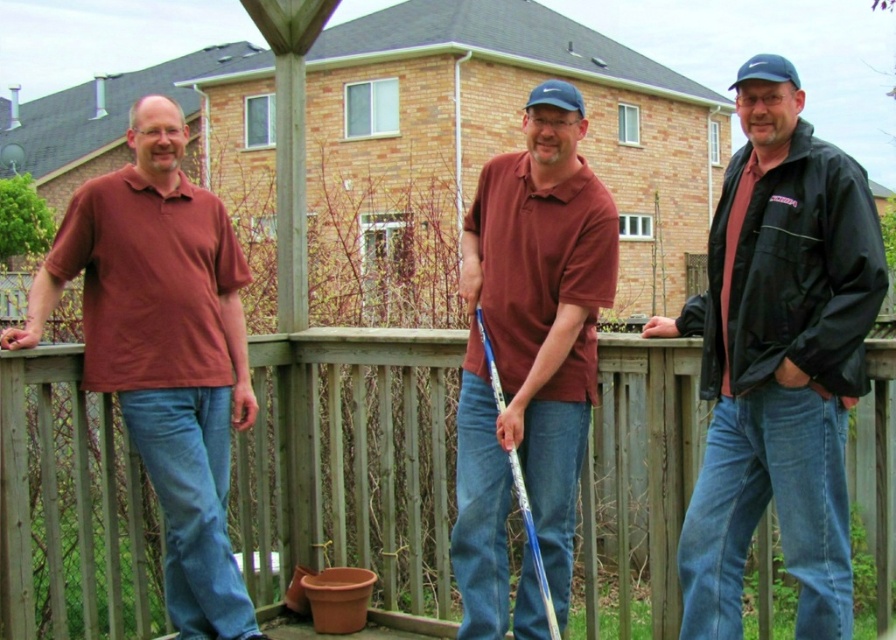
Is point (56, 244) behind point (527, 422)?

Yes, it is.

Does matte red shirt at left have a lesser height compared to matte maroon polo shirt at center?

In fact, matte red shirt at left may be taller than matte maroon polo shirt at center.

Between point (166, 372) and point (478, 461), which one is positioned behind?

The point (166, 372) is behind.

Find the location of a particular element. This screenshot has height=640, width=896. matte red shirt at left is located at coordinates (164, 349).

Is black matte jacket at center smaller than matte red shirt at left?

Correct, black matte jacket at center occupies less space than matte red shirt at left.

Between black matte jacket at center and matte red shirt at left, which one appears on the right side from the viewer's perspective?

Positioned to the right is black matte jacket at center.

Based on the photo, measure the distance between point [721,208] and camera.

Point [721,208] and camera are 12.98 feet apart from each other.

Where is `black matte jacket at center`? black matte jacket at center is located at coordinates click(778, 360).

Based on the photo, who is taller, wooden railing at center or black matte jacket at center?

black matte jacket at center is taller.

Is wooden railing at center positioned before black matte jacket at center?

No, wooden railing at center is further to the viewer.

What do you see at coordinates (349, 460) in the screenshot? I see `wooden railing at center` at bounding box center [349, 460].

I want to click on wooden railing at center, so click(x=349, y=460).